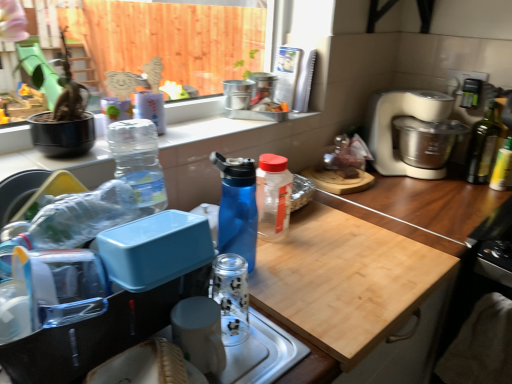
Where is `free spot above wooden cutting board at center (from a real-world perspective)`? The height and width of the screenshot is (384, 512). free spot above wooden cutting board at center (from a real-world perspective) is located at coordinates (317, 249).